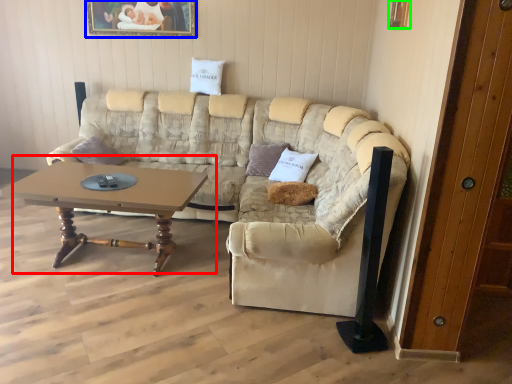
Question: Which object is positioned farthest from coffee table (highlighted by a red box)? Select from picture frame (highlighted by a blue box) and picture frame (highlighted by a green box).

Choices:
 (A) picture frame
 (B) picture frame

Answer: (B)